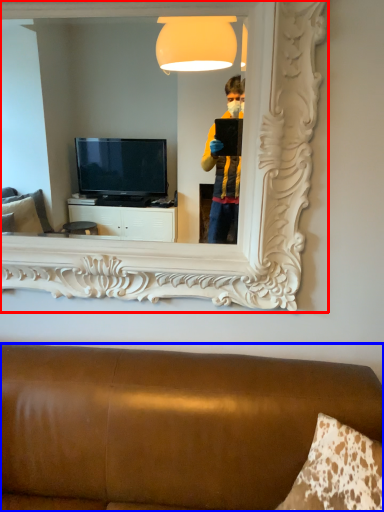
Question: Which object appears farthest to the camera in this image, mirror (highlighted by a red box) or furniture (highlighted by a blue box)?

Choices:
 (A) mirror
 (B) furniture

Answer: (A)